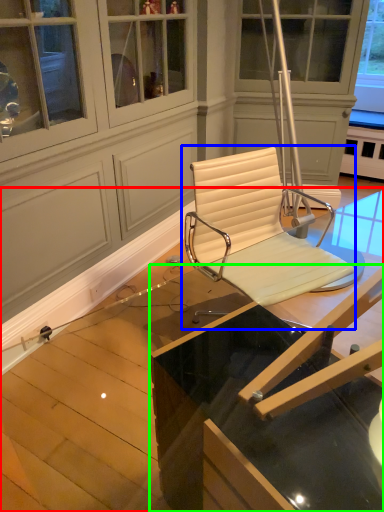
Question: Considering the real-world distances, which object is closest to table (highlighted by a red box)? chair (highlighted by a blue box) or table (highlighted by a green box).

Choices:
 (A) chair
 (B) table

Answer: (A)